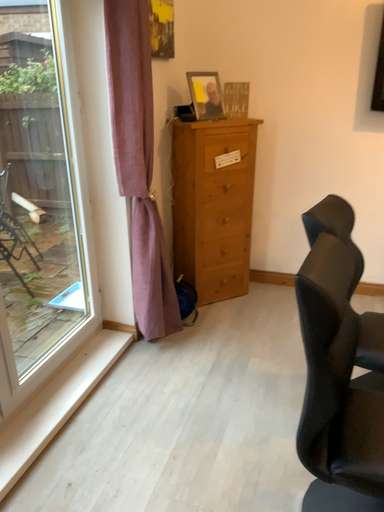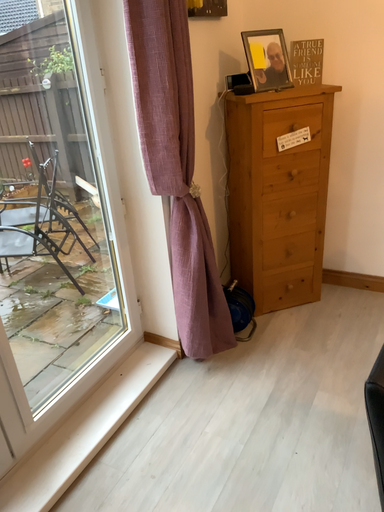
Question: Which way did the camera rotate in the video?

Choices:
 (A) rotated left
 (B) rotated right

Answer: (A)